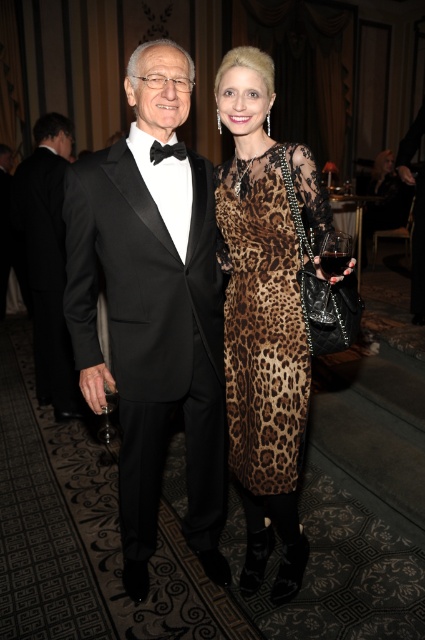
This screenshot has height=640, width=425. In order to click on black satin tuxedo at left in this screenshot , I will do `click(47, 260)`.

Consider the image. Is black satin tuxedo at left to the left of clear glass wine glass at left from the viewer's perspective?

Yes, black satin tuxedo at left is to the left of clear glass wine glass at left.

Locate an element on the screen. This screenshot has width=425, height=640. black satin tuxedo at left is located at coordinates (47, 260).

Who is higher up, leopard print dress at center or clear glass wine glass at left?

leopard print dress at center is above.

Is leopard print dress at center below clear glass wine glass at left?

Incorrect, leopard print dress at center is not positioned below clear glass wine glass at left.

Is point (244, 305) less distant than point (113, 406)?

Yes, point (244, 305) is closer to viewer.

The image size is (425, 640). Identify the location of leopard print dress at center. (261, 324).

Does shiny black tuxedo at left lie behind clear glass wine glass at left?

That is False.

Who is lower down, shiny black tuxedo at left or clear glass wine glass at left?

Positioned lower is clear glass wine glass at left.

Between point (175, 384) and point (104, 429), which one is positioned in front?

Point (175, 384) is in front.

Image resolution: width=425 pixels, height=640 pixels. In order to click on shiny black tuxedo at left in this screenshot , I will do `click(153, 310)`.